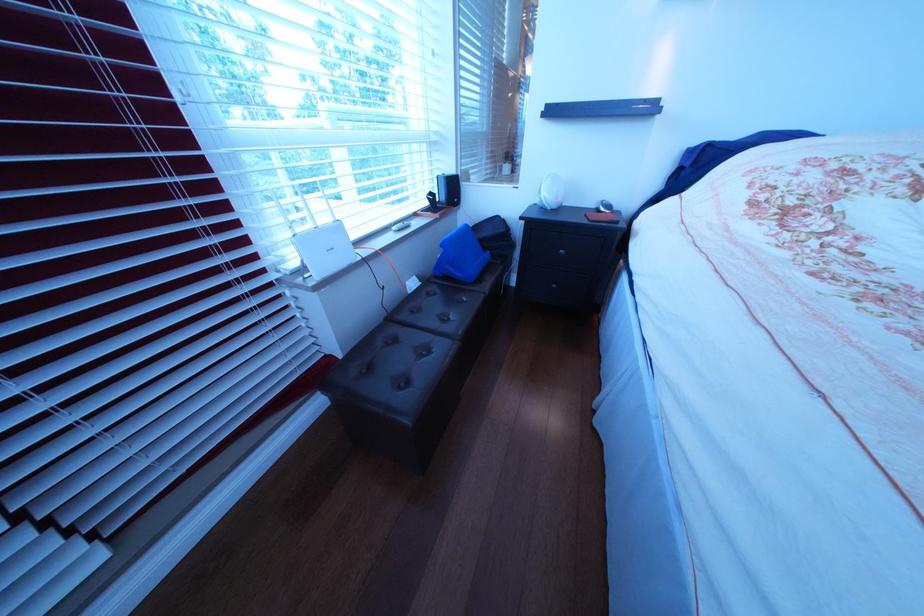
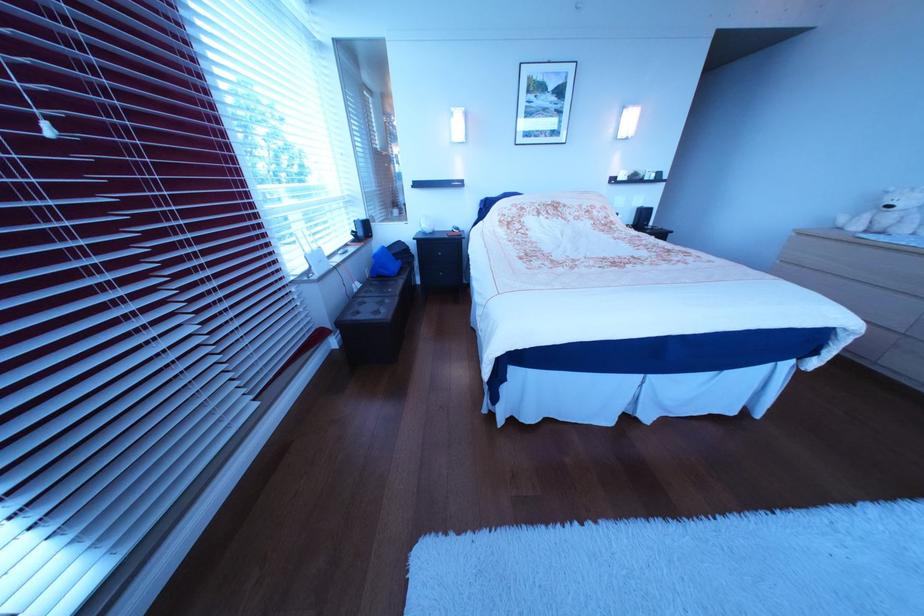
In the second image, find the point that corresponds to the point at 569,208 in the first image.

(445, 233)